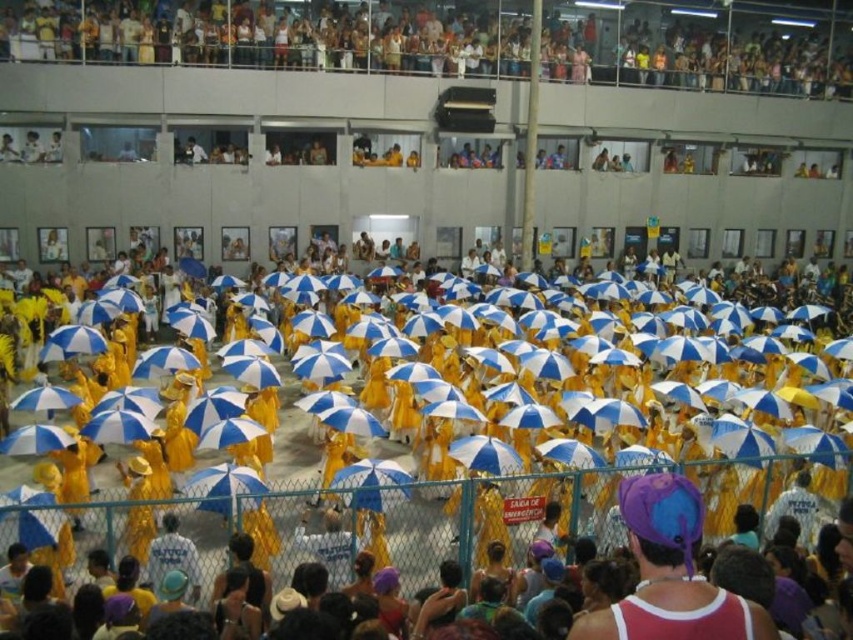
Does yellow fabric umbrellas at upper center appear on the right side of purple fabric hat at center?

Indeed, yellow fabric umbrellas at upper center is positioned on the right side of purple fabric hat at center.

Is yellow fabric umbrellas at upper center wider than purple fabric hat at center?

Yes.

Which is in front, point (4, 10) or point (701, 515)?

Point (701, 515)

The width and height of the screenshot is (853, 640). I want to click on yellow fabric umbrellas at upper center, so click(x=267, y=35).